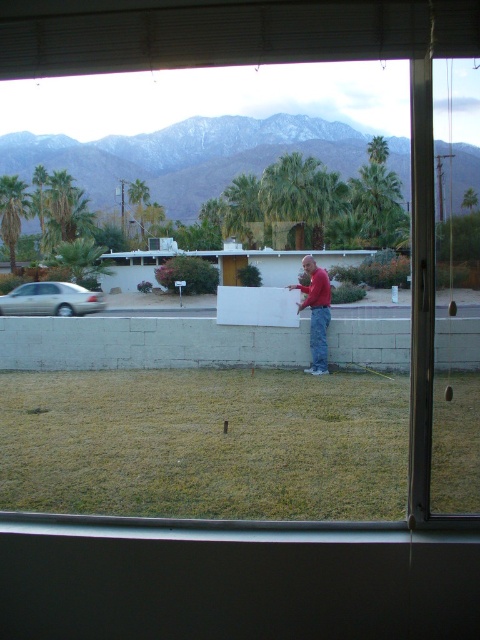
Question: Which object is closer to the camera taking this photo?

Choices:
 (A) green grass at lower center
 (B) green leafy palm tree at center
 (C) gold metallic sedan at left

Answer: (A)

Question: Can you confirm if green grass at lower center is positioned above gold metallic sedan at left?

Choices:
 (A) yes
 (B) no

Answer: (B)

Question: Is gold metallic sedan at left to the left of green leafy palm tree at center from the viewer's perspective?

Choices:
 (A) yes
 (B) no

Answer: (A)

Question: Which point appears closest to the camera in this image?

Choices:
 (A) (121, 371)
 (B) (37, 305)
 (C) (314, 371)
 (D) (405, 214)

Answer: (C)

Question: Which point is closer to the camera taking this photo?

Choices:
 (A) click(6, 216)
 (B) click(142, 216)
 (C) click(321, 330)
 (D) click(300, 392)

Answer: (D)

Question: Does green grass at lower center lie in front of green leafy palm tree at upper center?

Choices:
 (A) no
 (B) yes

Answer: (B)